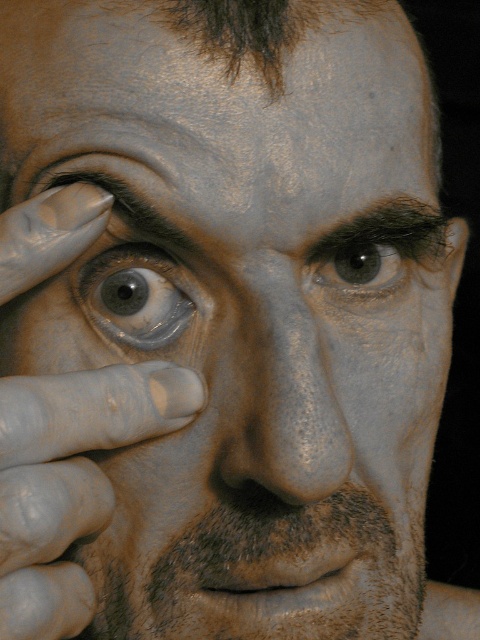
Question: Estimate the real-world distances between objects in this image. Which object is closer to the smooth skin at upper center?

Choices:
 (A) matte gray eye at center
 (B) brown fuzzy eyebrow at upper center
 (C) white matte finger at left
 (D) brown matte eye at center

Answer: (B)

Question: Which object appears closest to the camera in this image?

Choices:
 (A) smooth skin at upper center
 (B) matte gray nose at center
 (C) matte gray eye at center

Answer: (B)

Question: Does white matte finger at left have a lesser width compared to brown fuzzy eyebrow at upper center?

Choices:
 (A) yes
 (B) no

Answer: (A)

Question: Is brown fuzzy eyebrow at upper center below dark brown hair at upper center?

Choices:
 (A) yes
 (B) no

Answer: (B)

Question: Which point appears closest to the camera in this image?

Choices:
 (A) (212, 33)
 (B) (369, 253)

Answer: (A)

Question: Does matte gray nose at center appear on the right side of brown fuzzy eyebrow at upper center?

Choices:
 (A) no
 (B) yes

Answer: (A)